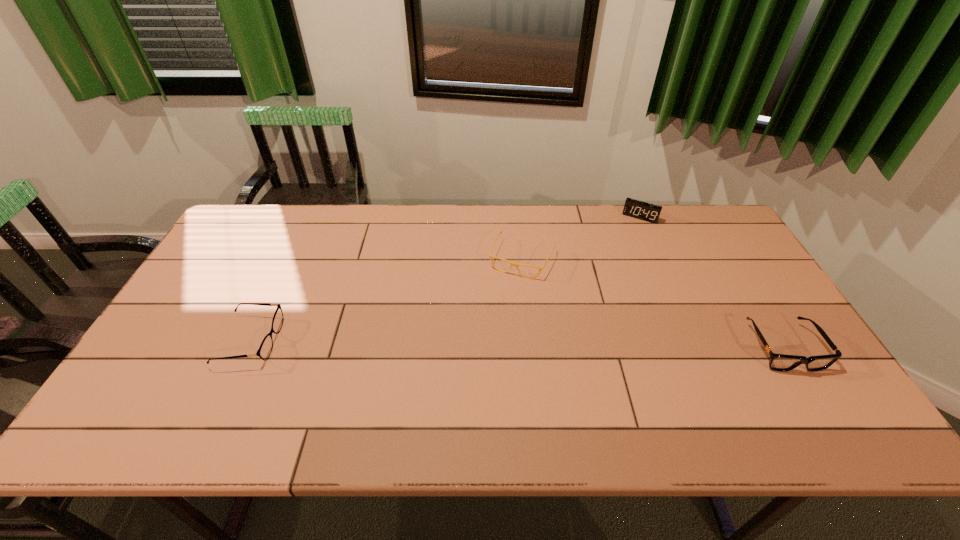
At what (x,y) coordinates should I click in order to perform the action: click on free space between the nearer spectacles and the farthest object. Please return your answer as a coordinate pair (x, y). Image resolution: width=960 pixels, height=540 pixels. Looking at the image, I should click on (445, 279).

Identify the location of vacant area that lies between the nearer spectacles and the farther spectacles. Image resolution: width=960 pixels, height=540 pixels. (386, 300).

Locate an element on the screen. unoccupied position between the leftmost object and the sunglasses is located at coordinates (516, 344).

Image resolution: width=960 pixels, height=540 pixels. I want to click on vacant space that is in between the nearer spectacles and the rightmost object, so click(x=516, y=344).

Identify the location of object that stands as the third closest to the third object from right to left. (265, 349).

I want to click on object that is the third nearest to the farthest object, so click(265, 349).

Locate an element on the screen. This screenshot has width=960, height=540. vacant space that satisfies the following two spatial constraints: 1. on the back side of the farthest object; 2. on the left side of the right spectacles is located at coordinates (517, 217).